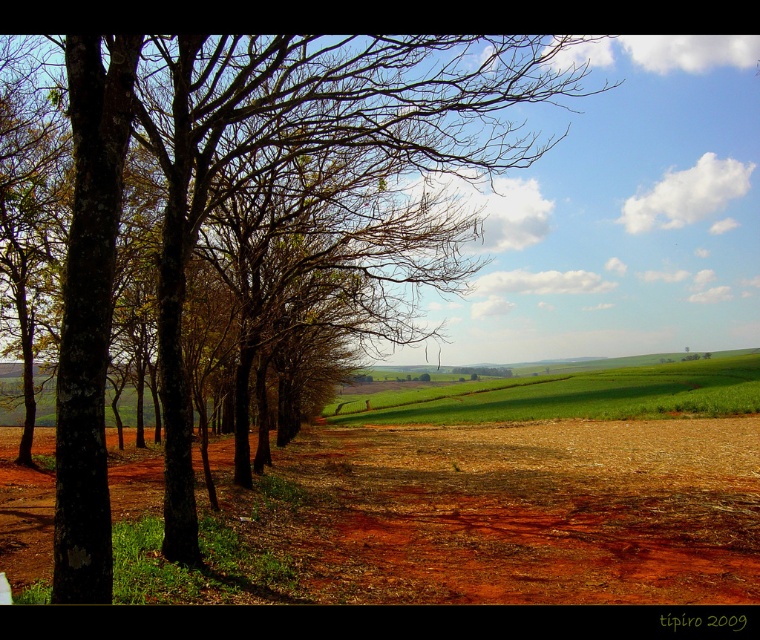
In the scene shown: Is brown rough tree at left further to camera compared to green grassy field at center?

No, it is in front of green grassy field at center.

Who is higher up, brown rough tree at left or green grassy field at center?

brown rough tree at left is above.

This screenshot has width=760, height=640. Find the location of `brown rough tree at left`. brown rough tree at left is located at coordinates (257, 188).

The width and height of the screenshot is (760, 640). In order to click on brown rough tree at left in this screenshot , I will do `click(257, 188)`.

Is brown dirt field at center below green grassy field at center?

Incorrect, brown dirt field at center is not positioned below green grassy field at center.

Is brown dirt field at center taller than green grassy field at center?

Incorrect, brown dirt field at center's height is not larger of green grassy field at center's.

Is point (543, 548) farther from viewer compared to point (515, 406)?

No.

This screenshot has height=640, width=760. What are the coordinates of `brown dirt field at center` in the screenshot? It's located at (534, 513).

Does brown rough tree at left have a greater height compared to brown dirt field at center?

Yes.

Who is lower down, brown rough tree at left or brown dirt field at center?

Positioned lower is brown dirt field at center.

This screenshot has height=640, width=760. What do you see at coordinates (257, 188) in the screenshot?
I see `brown rough tree at left` at bounding box center [257, 188].

Locate an element on the screen. brown rough tree at left is located at coordinates (257, 188).